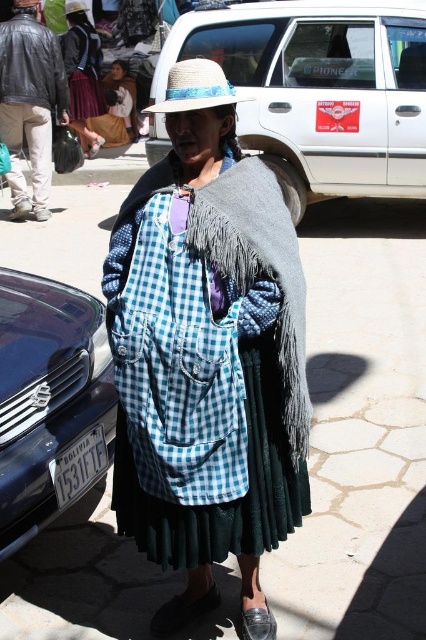
Can you confirm if metallic blue car at lower left is wider than fuzzy gray shawl at center?

Yes.

Is point (97, 321) farther from viewer compared to point (253, 220)?

Yes, point (97, 321) is behind point (253, 220).

Where is `metallic blue car at lower left`? metallic blue car at lower left is located at coordinates (49, 401).

Which is below, white matte van at upper center or fuzzy gray shawl at center?

fuzzy gray shawl at center is lower down.

What are the coordinates of `white matte van at upper center` in the screenshot? It's located at (321, 90).

Where is `white matte van at upper center`? The image size is (426, 640). white matte van at upper center is located at coordinates (321, 90).

Which is behind, point (359, 60) or point (247, 611)?

Point (359, 60)

Is point (419, 196) less distant than point (273, 637)?

No.

Locate an element on the screen. white matte van at upper center is located at coordinates (321, 90).